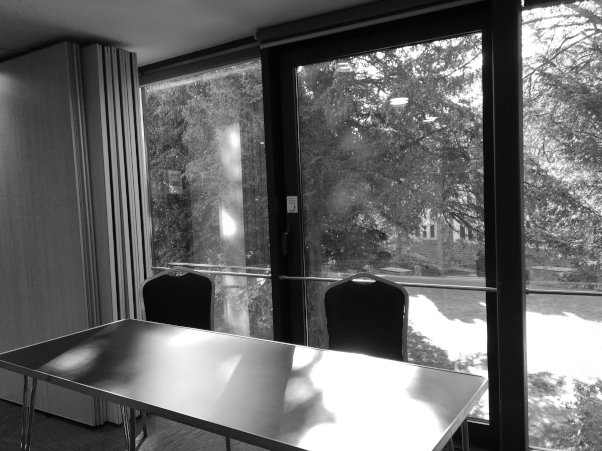
Find the location of a particular element. The height and width of the screenshot is (451, 602). left front table leg is located at coordinates (31, 399).